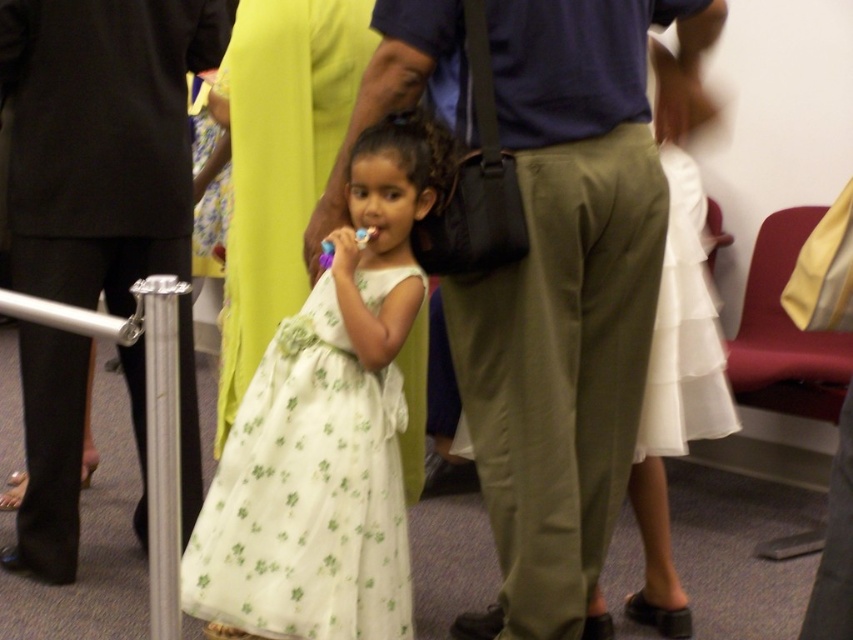
Question: Can you confirm if white floral dress at center is positioned to the right of black fabric pants at lower left?

Choices:
 (A) yes
 (B) no

Answer: (A)

Question: Which of the following is the closest to the observer?

Choices:
 (A) purple plastic toothbrush at center
 (B) white satin dress at center

Answer: (A)

Question: Which point is closer to the camera?

Choices:
 (A) matte olive green pants at center
 (B) matte plastic toothbrush at center

Answer: (A)

Question: Does matte olive green pants at center appear under white satin dress at center?

Choices:
 (A) no
 (B) yes

Answer: (B)

Question: Where is white floral dress at center located in relation to black fabric pants at lower left in the image?

Choices:
 (A) left
 (B) right

Answer: (B)

Question: Which of the following is the closest to the observer?

Choices:
 (A) (370, 236)
 (B) (688, 211)

Answer: (A)